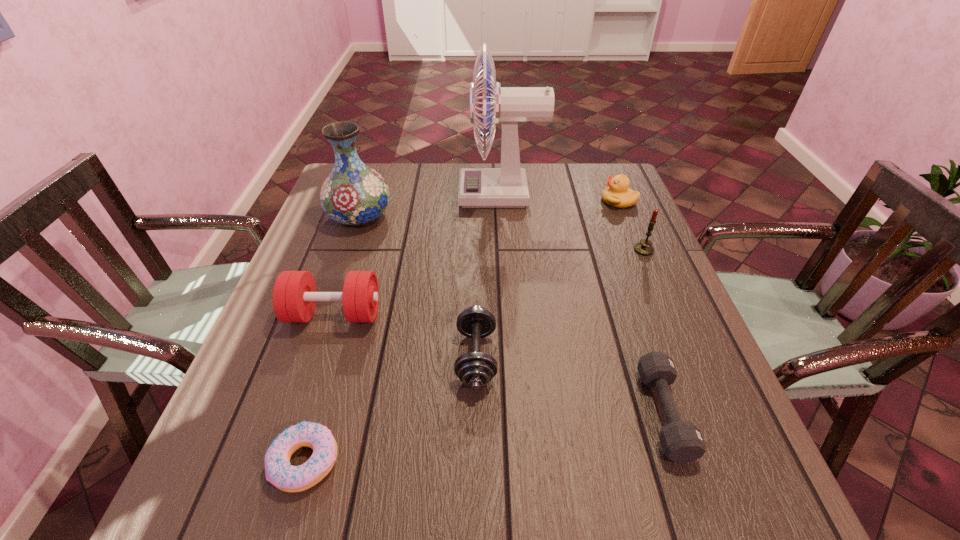
Where is `dumbbell positioned at the right edge`? dumbbell positioned at the right edge is located at coordinates (681, 441).

Where is `object positioned at the far left corner`? object positioned at the far left corner is located at coordinates (353, 194).

Identify the location of object that is at the near left corner. Image resolution: width=960 pixels, height=540 pixels. (278, 470).

The image size is (960, 540). In order to click on object at the far right corner in this screenshot , I will do `click(618, 194)`.

The width and height of the screenshot is (960, 540). Find the location of `vacant space at the far edge of the desktop`. vacant space at the far edge of the desktop is located at coordinates (457, 163).

You are a GUI agent. You are given a task and a screenshot of the screen. Output one action in this format:
    pyautogui.click(x=<x>, y=<y>)
    Task: Click on the blank space at the near edge of the desktop
    This screenshot has height=540, width=960.
    Given the screenshot: What is the action you would take?
    pyautogui.click(x=509, y=473)

The image size is (960, 540). I want to click on vacant area at the left edge, so click(x=271, y=386).

In the image, there is a desktop. Identify the location of vacant space at the right edge. (594, 214).

Where is `vacant space at the near left corner of the desktop`? This screenshot has height=540, width=960. vacant space at the near left corner of the desktop is located at coordinates (230, 474).

Where is `empty space that is in between the duckling and the shortest dumbbell`? empty space that is in between the duckling and the shortest dumbbell is located at coordinates (641, 307).